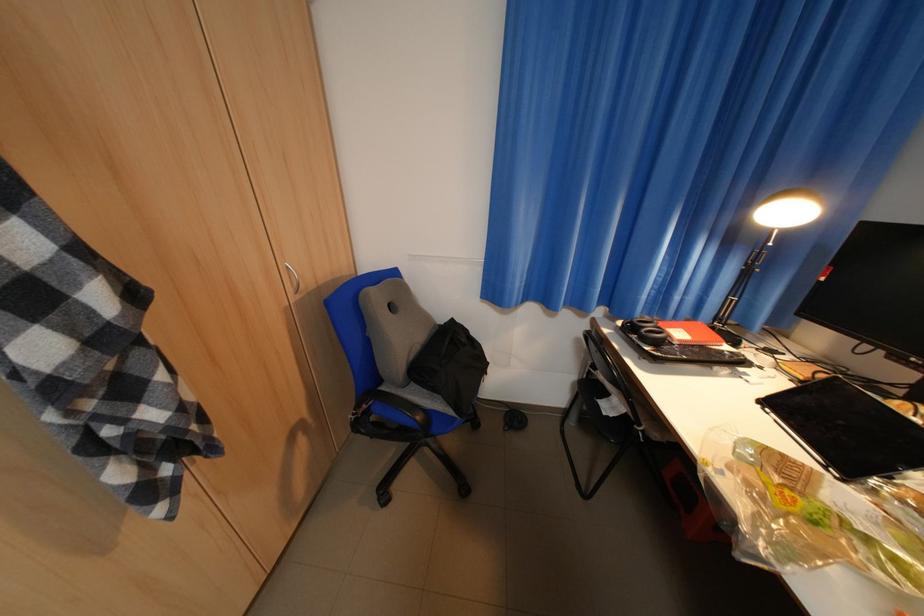
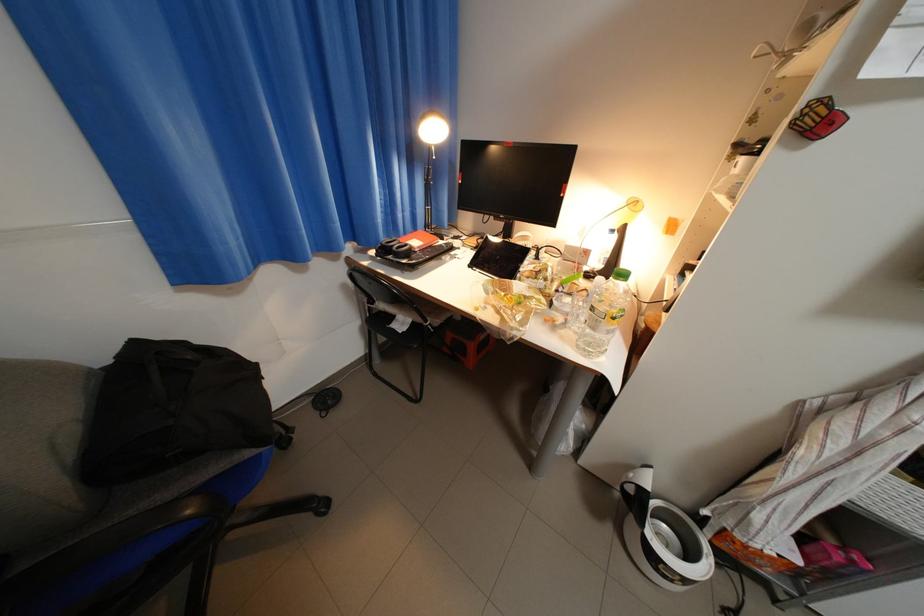
In the second image, find the point that corresponds to [589,341] in the first image.

(355, 286)